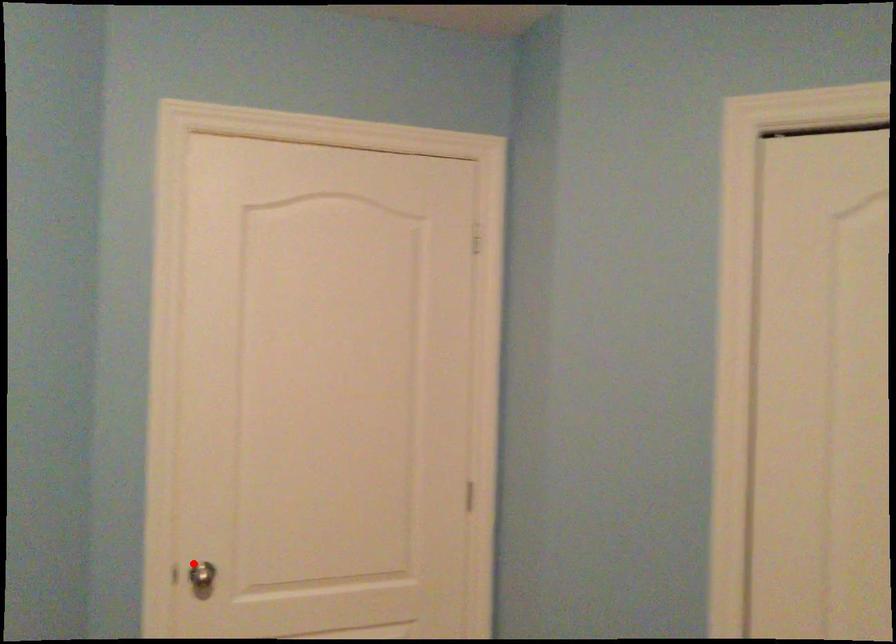
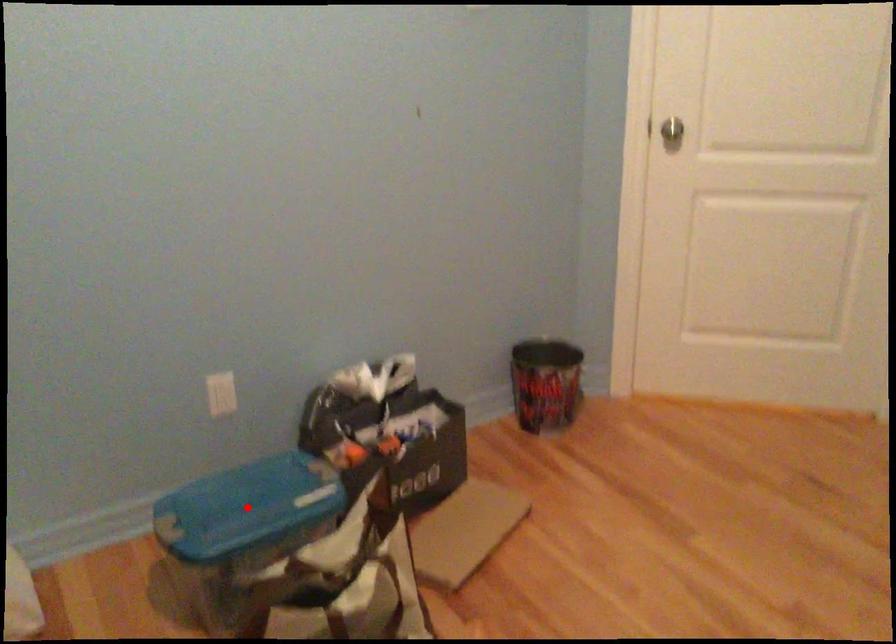
I am providing you with two images of the same scene from different viewpoints. A red point is marked on the first image and another point is marked on the second image. Does the point marked in image1 correspond to the same location as the one in image2?

No